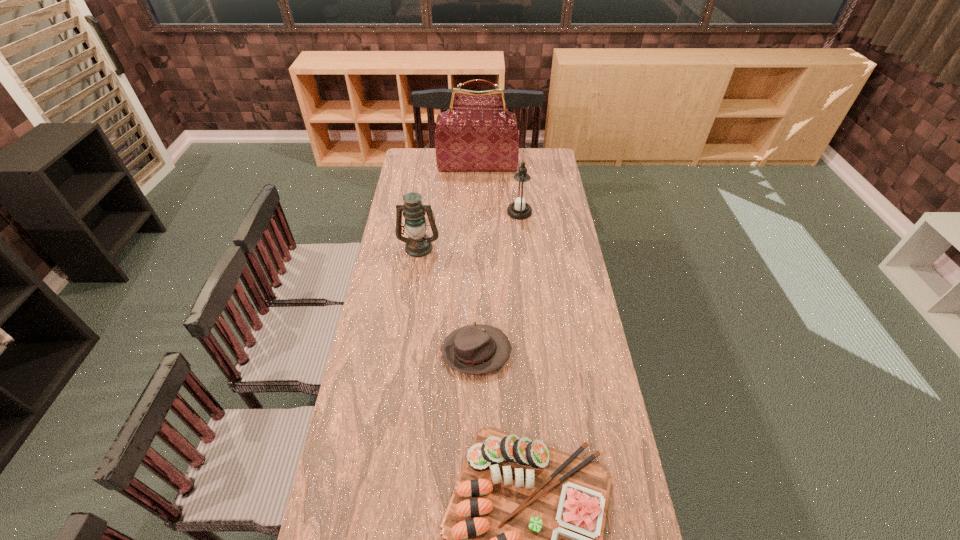
Locate an element on the screen. The image size is (960, 540). vacant space located on the front of the third shortest object is located at coordinates (412, 296).

Identify the location of free space located on the decorative side of the second shortest object. This screenshot has height=540, width=960. [x=534, y=352].

Where is `object that is at the far edge`? Image resolution: width=960 pixels, height=540 pixels. object that is at the far edge is located at coordinates (477, 133).

Where is `object at the left edge`? The height and width of the screenshot is (540, 960). object at the left edge is located at coordinates (418, 244).

Where is `vacant region at the left edge of the desktop`? vacant region at the left edge of the desktop is located at coordinates (376, 349).

In the image, there is a desktop. Identify the location of free region at the right edge. (564, 320).

Where is `blank space at the far left corner of the desktop`? blank space at the far left corner of the desktop is located at coordinates point(429,167).

This screenshot has height=540, width=960. In order to click on unoccupied area between the third shortest object and the tallest object in this screenshot , I will do `click(448, 206)`.

Where is `vacant space that's between the farthest object and the fourth nearest object`? The image size is (960, 540). vacant space that's between the farthest object and the fourth nearest object is located at coordinates (498, 189).

Where is `free space that is in between the right oil lamp and the farthest object`? free space that is in between the right oil lamp and the farthest object is located at coordinates (498, 189).